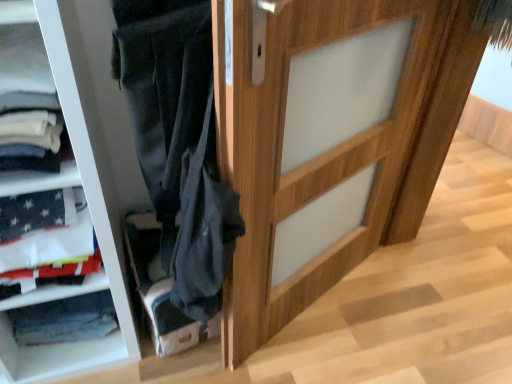
At what (x,y) coordinates should I click in order to perform the action: click on free spot to the right of wooden door at center. Please return your answer as a coordinate pair (x, y). This screenshot has height=384, width=512. Looking at the image, I should click on (377, 321).